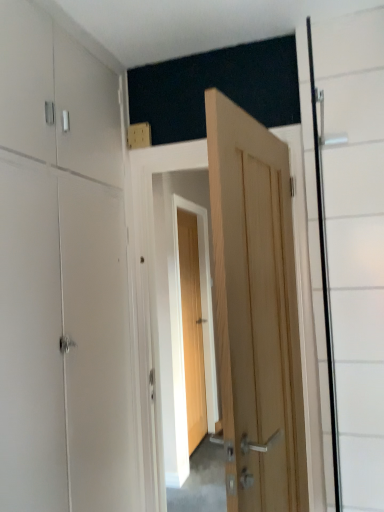
Question: Considering the relative positions of white matte cabinet at left and natural wood door at center, acting as the first door starting from the front, in the image provided, is white matte cabinet at left to the left of natural wood door at center, acting as the first door starting from the front, from the viewer's perspective?

Choices:
 (A) no
 (B) yes

Answer: (B)

Question: Is white matte cabinet at left turned away from natural wood door at center, acting as the first door starting from the front?

Choices:
 (A) yes
 (B) no

Answer: (A)

Question: Can you confirm if white matte cabinet at left is shorter than natural wood door at center, acting as the first door starting from the front?

Choices:
 (A) yes
 (B) no

Answer: (B)

Question: Is white matte cabinet at left oriented towards natural wood door at center, acting as the second door starting from the back?

Choices:
 (A) no
 (B) yes

Answer: (B)

Question: Does white matte cabinet at left appear on the right side of natural wood door at center, acting as the second door starting from the back?

Choices:
 (A) no
 (B) yes

Answer: (A)

Question: Is natural wood door at center, acting as the first door starting from the front, wider or thinner than wooden door at center, which is the 1th door in back-to-front order?

Choices:
 (A) wide
 (B) thin

Answer: (A)

Question: Is natural wood door at center, acting as the second door starting from the back, spatially inside wooden door at center, which is the 1th door in back-to-front order, or outside of it?

Choices:
 (A) outside
 (B) inside

Answer: (A)

Question: Is point (225, 196) positioned closer to the camera than point (187, 394)?

Choices:
 (A) closer
 (B) farther

Answer: (A)

Question: From a real-world perspective, is natural wood door at center, acting as the second door starting from the back, positioned above or below wooden door at center, which appears as the 2th door when viewed from the front?

Choices:
 (A) above
 (B) below

Answer: (A)

Question: Visually, is natural wood door at center, acting as the first door starting from the front, positioned to the left or to the right of white matte cabinet at left?

Choices:
 (A) right
 (B) left

Answer: (A)

Question: From the image's perspective, is natural wood door at center, acting as the first door starting from the front, above or below white matte cabinet at left?

Choices:
 (A) above
 (B) below

Answer: (B)

Question: Relative to white matte cabinet at left, is natural wood door at center, acting as the first door starting from the front, in front or behind?

Choices:
 (A) behind
 (B) front

Answer: (A)

Question: Is natural wood door at center, acting as the second door starting from the back, situated inside white matte cabinet at left or outside?

Choices:
 (A) inside
 (B) outside

Answer: (B)

Question: Considering the positions of wooden door at center, which is the 1th door in back-to-front order, and transparent glass door at right in the image, is wooden door at center, which is the 1th door in back-to-front order, wider or thinner than transparent glass door at right?

Choices:
 (A) thin
 (B) wide

Answer: (B)

Question: Based on their sizes in the image, would you say wooden door at center, which appears as the 2th door when viewed from the front, is bigger or smaller than transparent glass door at right?

Choices:
 (A) small
 (B) big

Answer: (B)